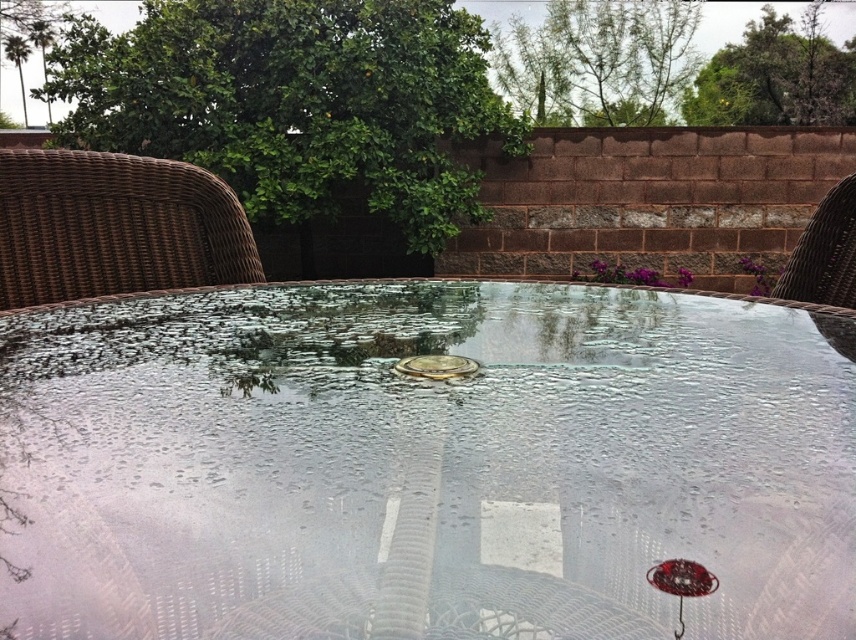
Question: Can you confirm if transparent glass table at center is bigger than brown wicker chair at left?

Choices:
 (A) no
 (B) yes

Answer: (B)

Question: Does brown wicker chair at left come behind brown wicker chair at right?

Choices:
 (A) no
 (B) yes

Answer: (A)

Question: Which point is farther to the camera?

Choices:
 (A) metallic gold coin at center
 (B) brown wicker chair at left

Answer: (B)

Question: Which object is positioned closest to the metallic gold coin at center?

Choices:
 (A) transparent glass table at center
 (B) brown wicker chair at left

Answer: (A)

Question: Does transparent glass table at center appear on the left side of brown wicker chair at left?

Choices:
 (A) yes
 (B) no

Answer: (B)

Question: Among these points, which one is nearest to the camera?

Choices:
 (A) (467, 372)
 (B) (587, 493)
 (C) (31, 305)

Answer: (B)